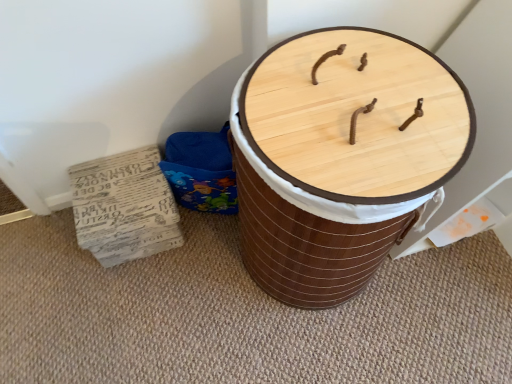
Where is `free space in front of recycled paper stack at lower left`? free space in front of recycled paper stack at lower left is located at coordinates (130, 302).